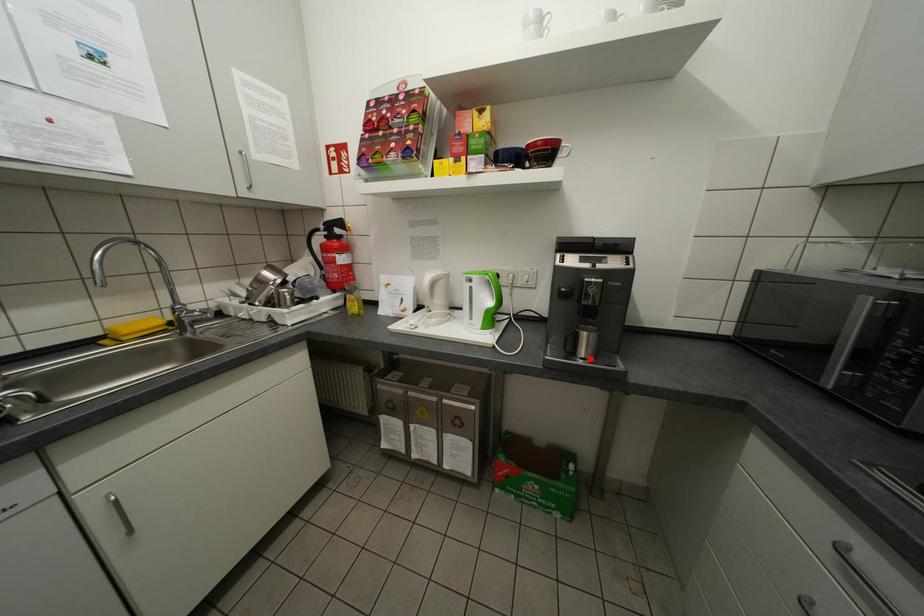
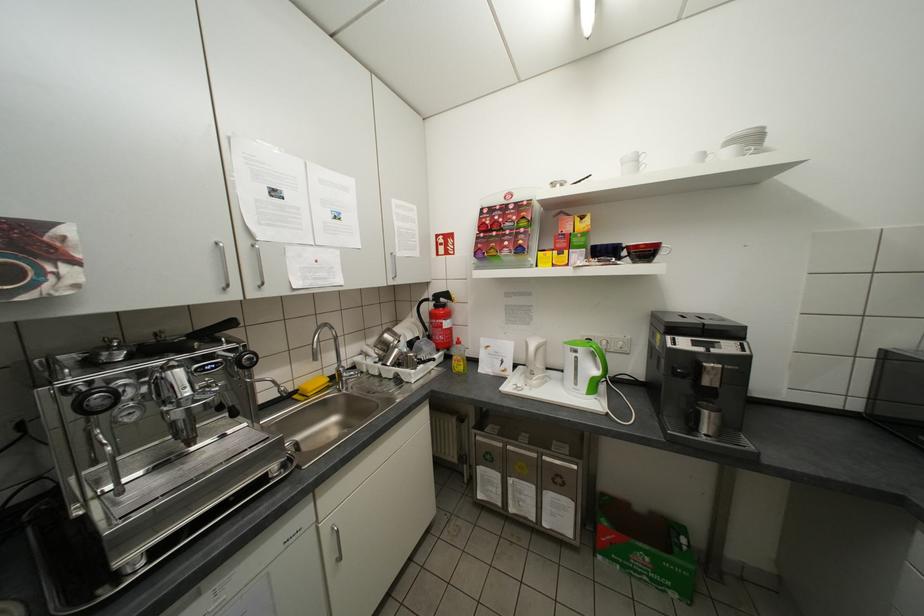
In the second image, find the point that corresponds to the highlighted location in the first image.

(714, 436)